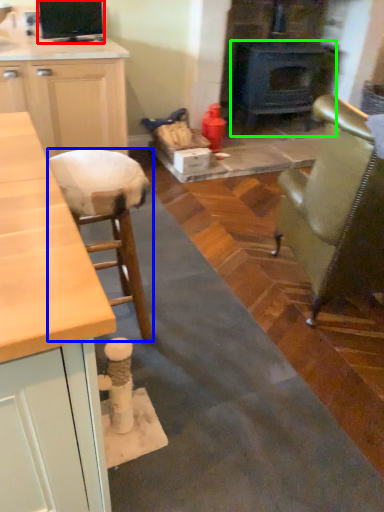
Question: Which object is positioned closest to appliance (highlighted by a red box)? Select from stool (highlighted by a blue box) and wood burning stove (highlighted by a green box).

Choices:
 (A) stool
 (B) wood burning stove

Answer: (A)